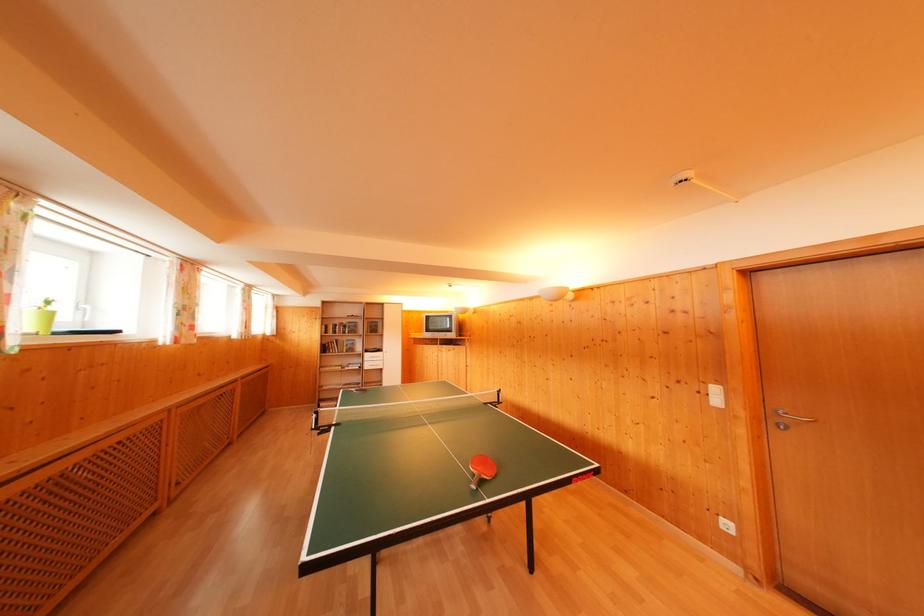
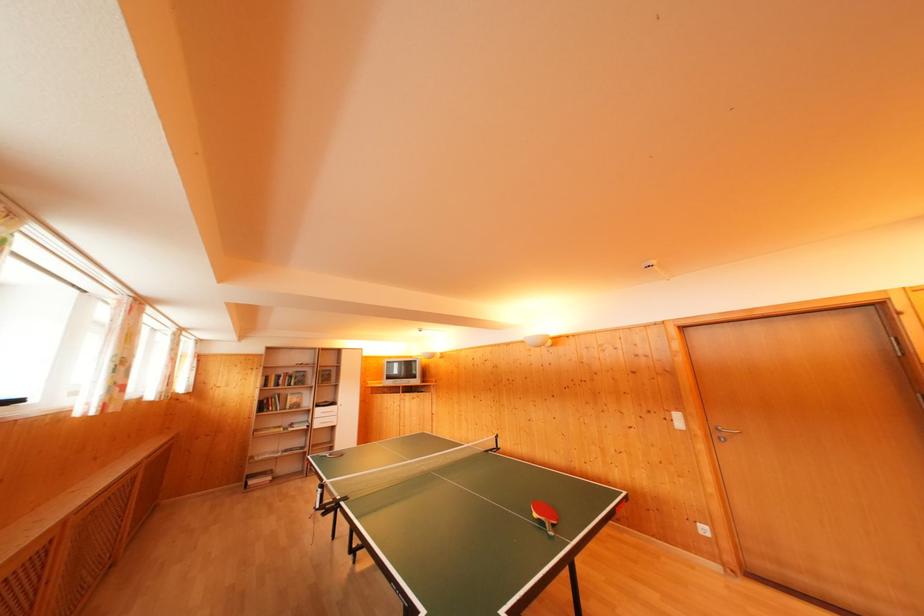
Locate, in the second image, the point that corresponds to (x=371, y=360) in the first image.

(322, 416)